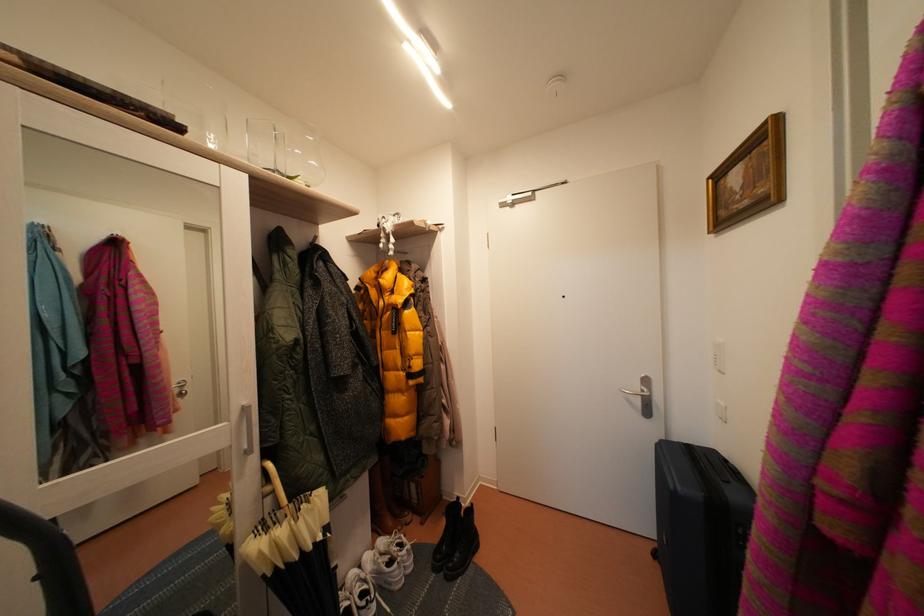
Find where to lift the black suitcase. Please return your answer as a coordinate pair (x, y).

(699, 528)